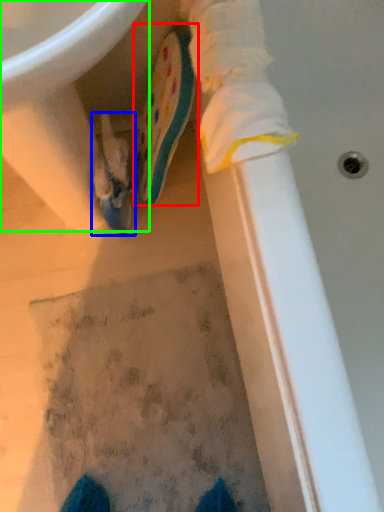
Question: Which object is the farthest from footwear (highlighted by a red box)? Choose among these: footwear (highlighted by a blue box) or sink (highlighted by a green box).

Choices:
 (A) footwear
 (B) sink

Answer: (B)